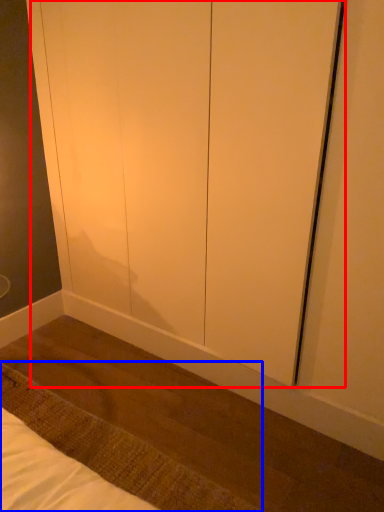
Question: Which of the following is the closest to the observer, screen door (highlighted by a red box) or mat (highlighted by a blue box)?

Choices:
 (A) screen door
 (B) mat

Answer: (A)